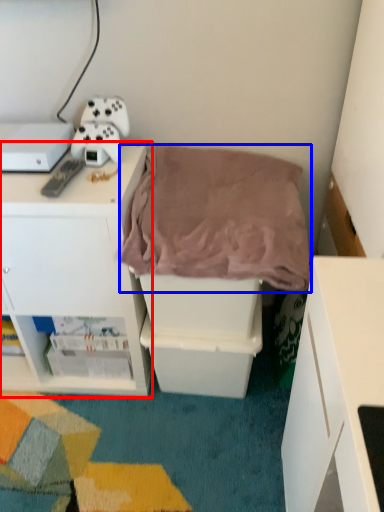
Question: Which object is closer to the camera taking this photo, cabinetry (highlighted by a red box) or blanket (highlighted by a blue box)?

Choices:
 (A) cabinetry
 (B) blanket

Answer: (B)